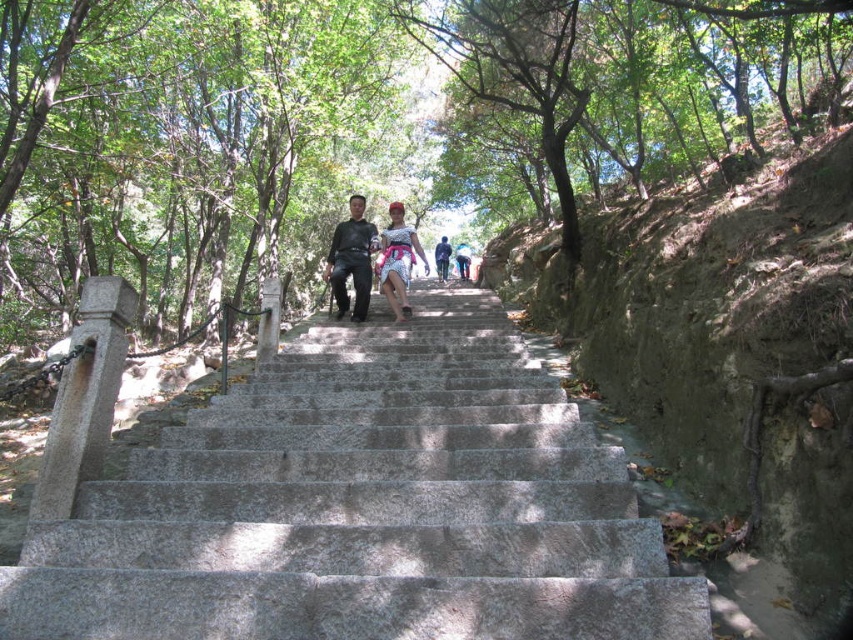
Question: Which object appears closest to the camera in this image?

Choices:
 (A) matte black dress at center
 (B) dull gray stone stairs at center

Answer: (B)

Question: Estimate the real-world distances between objects in this image. Which object is closer to the matte black dress at center?

Choices:
 (A) gray stone stairs at center
 (B) white printed dress at center
 (C) dull gray stone stairs at center
 (D) dark gray fabric pants at center

Answer: (B)

Question: Among these points, which one is nearest to the camera?

Choices:
 (A) (405, 304)
 (B) (791, 244)
 (C) (440, 253)
 (D) (448, 248)

Answer: (B)

Question: Is dull gray stone stairs at center above dark gray fabric pants at center?

Choices:
 (A) no
 (B) yes

Answer: (A)

Question: Is dull gray stone stairs at center below white printed dress at center?

Choices:
 (A) yes
 (B) no

Answer: (B)

Question: Is dark gray fabric pants at center further to the viewer compared to white printed dress at center?

Choices:
 (A) yes
 (B) no

Answer: (A)